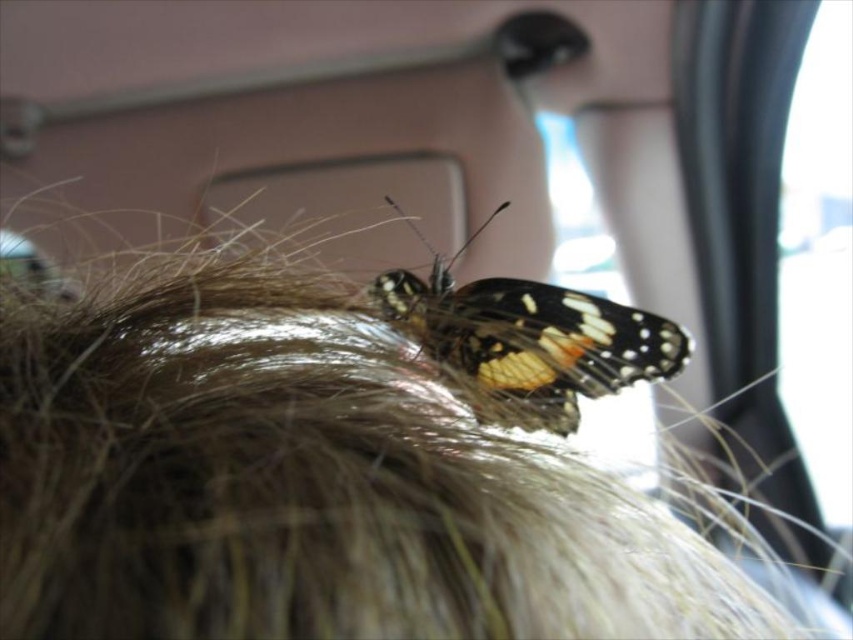
In the scene shown: You are a photographer trying to capture a close shot of the shiny orange butterfly at center. However, the brown fuzzy hair at upper center is blocking your view. Can you estimate whether the butterfly is smaller than the hair?

The brown fuzzy hair at upper center has a larger size compared to the shiny orange butterfly at center, so yes, the butterfly is smaller than the hair.

You are a photographer trying to capture the butterfly on the hair. If you want to ensure both the brown fuzzy hair at upper center and the shiny orange butterfly at center are fully visible in the frame, which object should you focus on to avoid cropping?

You should focus on the brown fuzzy hair at upper center because it is wider than the shiny orange butterfly at center, so ensuring the wider object fits will automatically include the narrower one.